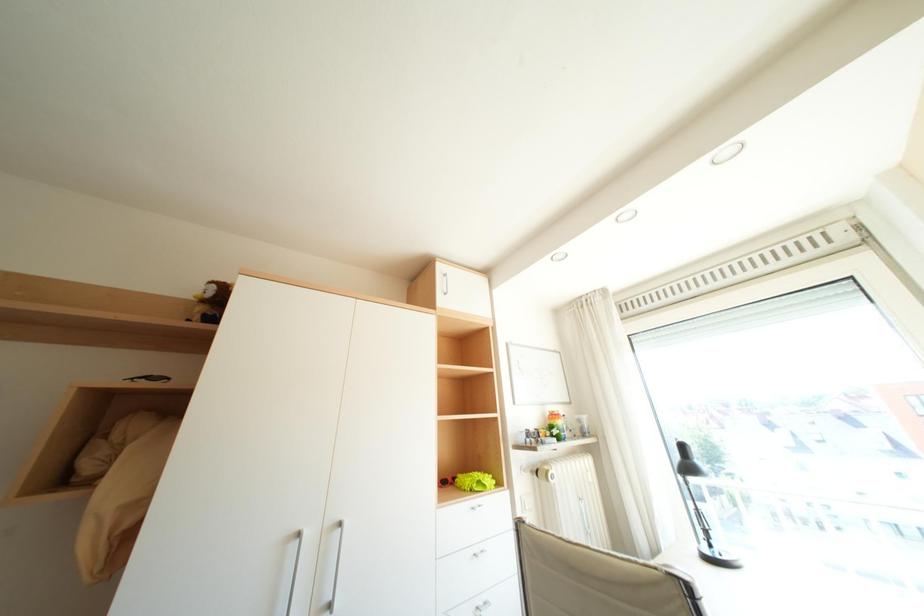
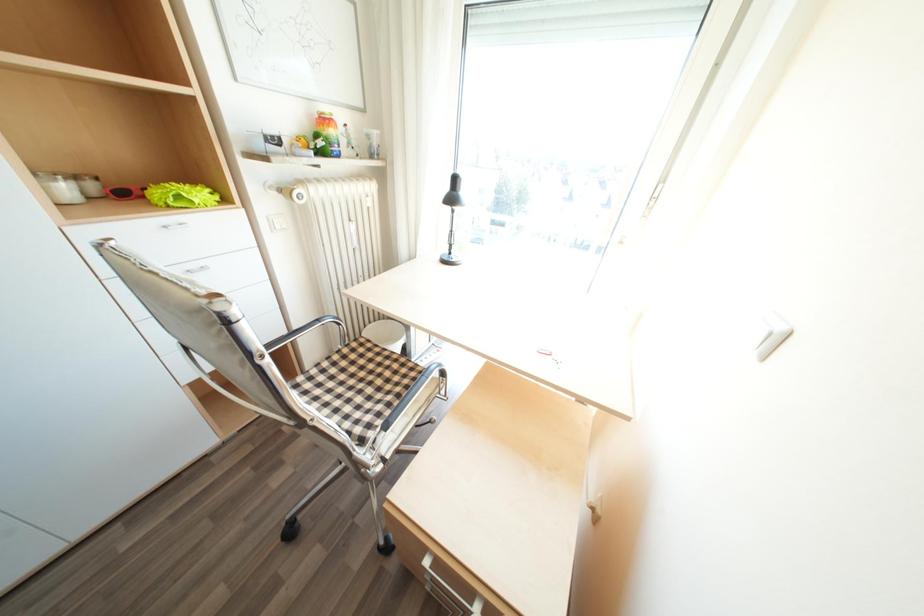
Based on the photo, how did the camera likely rotate?

The camera's rotation is toward right-down.